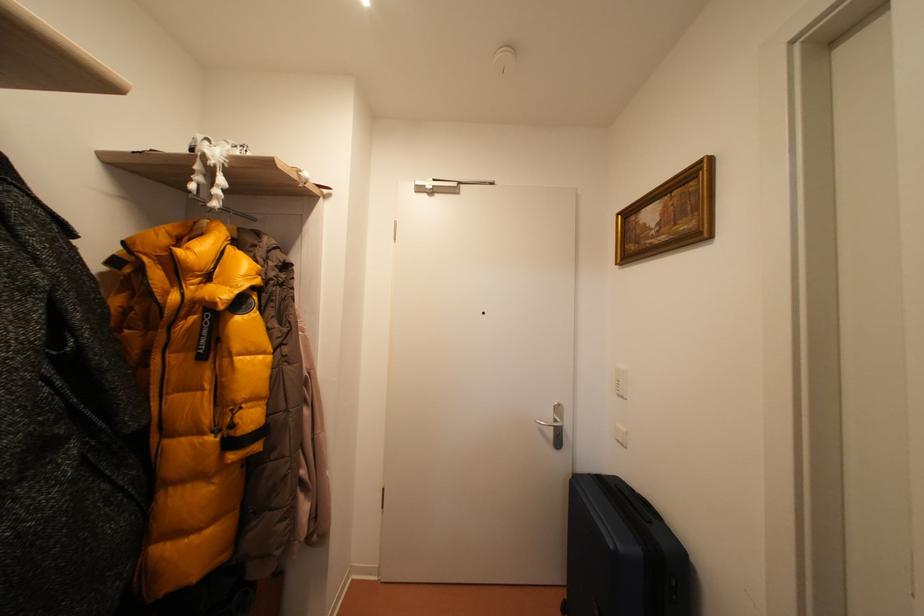
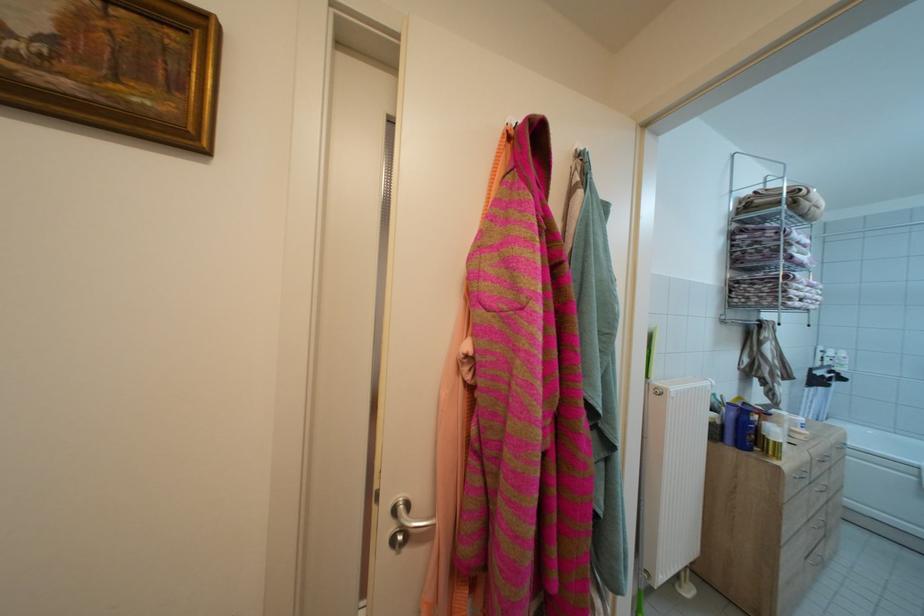
Question: Based on the continuous images, in which direction is the camera rotating? Reply with the corresponding letter.

Choices:
 (A) Left
 (B) Right
 (C) Up
 (D) Down

Answer: (B)